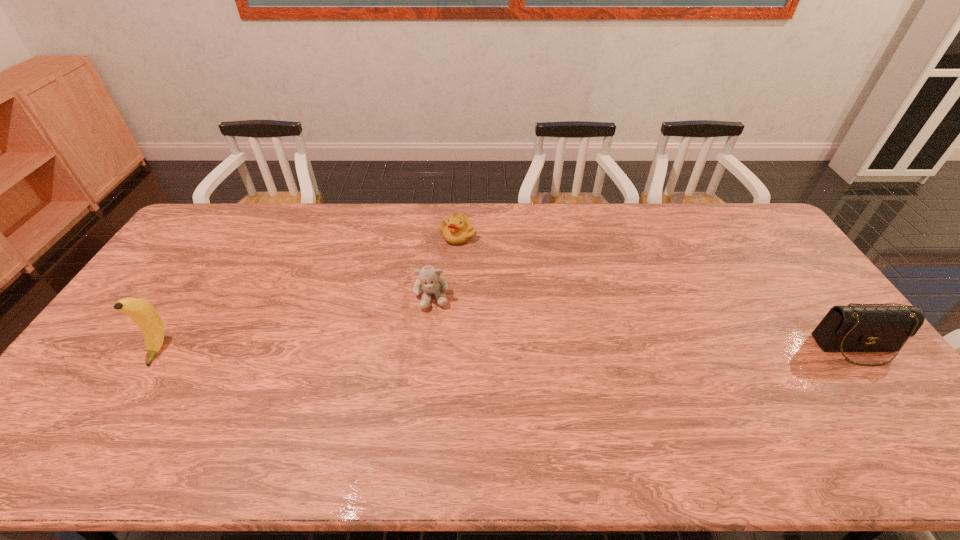
Image resolution: width=960 pixels, height=540 pixels. Identify the location of free space located on the front-facing side of the farthest object. (432, 310).

Locate an element on the screen. free space located 0.090m on the face of the second farthest object is located at coordinates (434, 336).

Where is `free space located 0.240m on the face of the second farthest object`? free space located 0.240m on the face of the second farthest object is located at coordinates (438, 381).

At what (x,y) coordinates should I click in order to perform the action: click on vacant space located on the face of the second farthest object. Please return your answer as a coordinate pair (x, y). The height and width of the screenshot is (540, 960). Looking at the image, I should click on coord(434,333).

Locate an element on the screen. The width and height of the screenshot is (960, 540). object that is at the far edge is located at coordinates (458, 229).

What are the coordinates of `object at the left edge` in the screenshot? It's located at (145, 316).

Find the location of `object situated at the right edge`. object situated at the right edge is located at coordinates (871, 328).

This screenshot has width=960, height=540. In the image, there is a desktop. In order to click on free space at the far edge in this screenshot , I will do `click(644, 239)`.

Where is `vacant space at the near edge of the desktop`? This screenshot has height=540, width=960. vacant space at the near edge of the desktop is located at coordinates (748, 397).

In order to click on vacant space at the left edge of the desktop in this screenshot , I will do `click(183, 272)`.